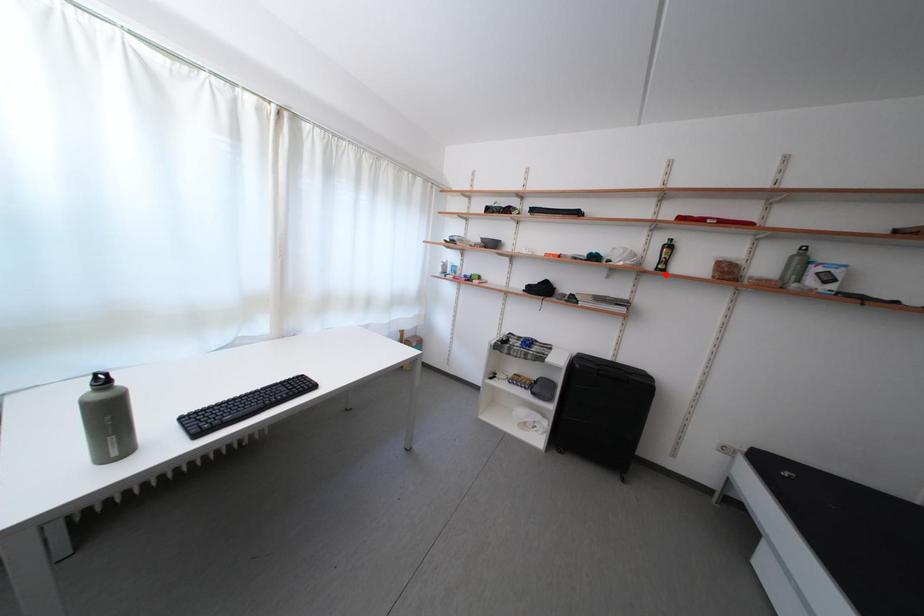
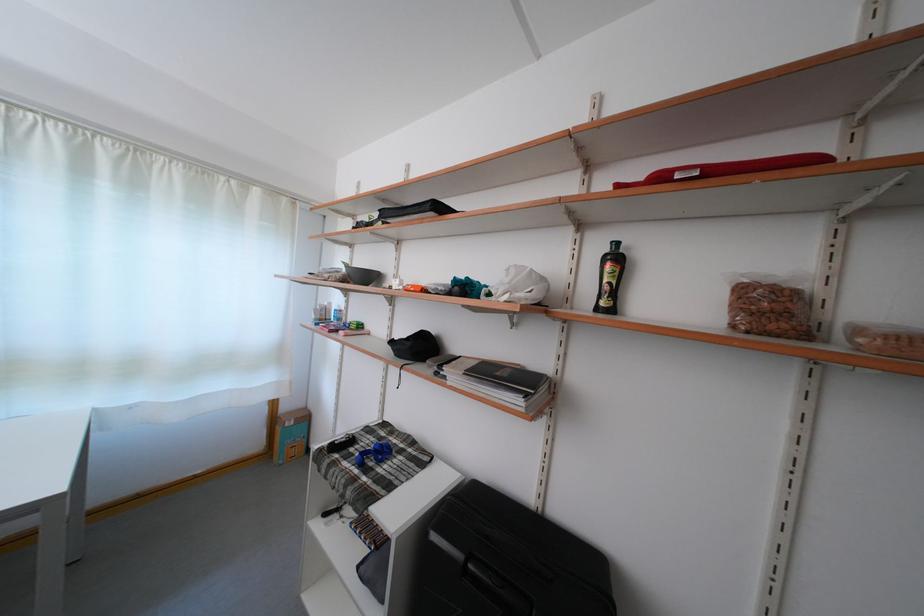
Locate, in the second image, the point that corresponds to the highlighted location in the first image.

(606, 314)